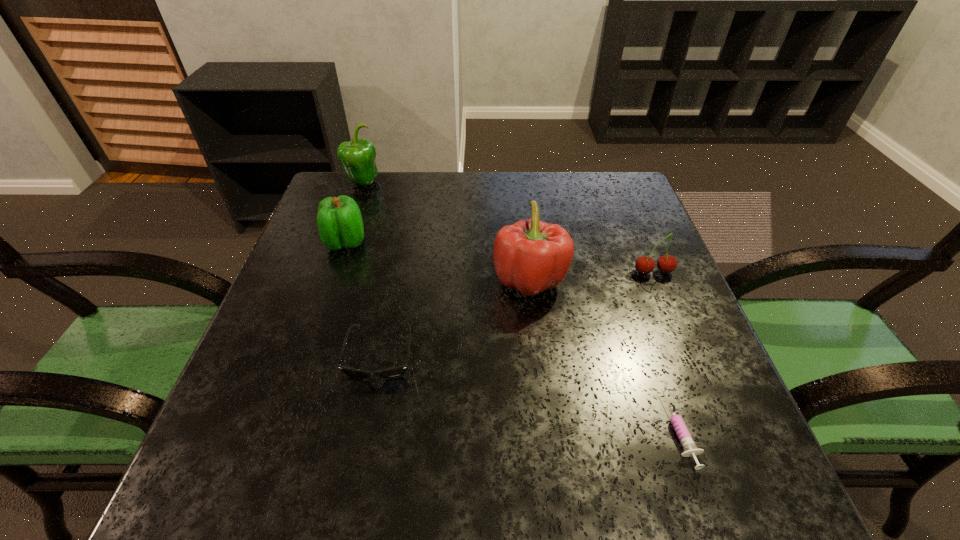
This screenshot has width=960, height=540. Identify the location of vacant space that's between the fifth tallest object and the shortest object. (531, 393).

This screenshot has width=960, height=540. What are the coordinates of `vacant area that lies between the cherry and the shortest object` in the screenshot? It's located at (667, 350).

You are a GUI agent. You are given a task and a screenshot of the screen. Output one action in this format:
    pyautogui.click(x=<x>, y=<y>)
    Task: Click on the third closest object relative to the cherry
    The width and height of the screenshot is (960, 540).
    Given the screenshot: What is the action you would take?
    pyautogui.click(x=391, y=373)

Locate which object is the fifth closest to the sunglasses. Please provide its 2D coordinates. Your answer should be formatted as a tuple, i.e. [(x, y)], where the tuple contains the x and y coordinates of a point satisfying the conditions above.

[(667, 263)]

Locate an element on the screen. This screenshot has width=960, height=540. bell pepper that is the second closest to the second shortest object is located at coordinates (339, 220).

Locate which bell pepper is the second closest to the shortest bell pepper. Please provide its 2D coordinates. Your answer should be formatted as a tuple, i.e. [(x, y)], where the tuple contains the x and y coordinates of a point satisfying the conditions above.

[(532, 256)]

Where is `free space that satisfies the following two spatial constraints: 1. on the front side of the farthest bell pepper; 2. on the right side of the syringe`? free space that satisfies the following two spatial constraints: 1. on the front side of the farthest bell pepper; 2. on the right side of the syringe is located at coordinates (275, 429).

This screenshot has height=540, width=960. I want to click on free space that satisfies the following two spatial constraints: 1. on the front side of the farthest object; 2. on the right side of the shortest object, so click(x=275, y=429).

Where is `vacant space that satisfies the following two spatial constraints: 1. on the front side of the shortest bell pepper; 2. on the right side of the farthest bell pepper`? vacant space that satisfies the following two spatial constraints: 1. on the front side of the shortest bell pepper; 2. on the right side of the farthest bell pepper is located at coordinates (341, 242).

Where is `free spot that satisfies the following two spatial constraints: 1. on the front-facing side of the shortest object; 2. on the left side of the fifth farthest object`? Image resolution: width=960 pixels, height=540 pixels. free spot that satisfies the following two spatial constraints: 1. on the front-facing side of the shortest object; 2. on the left side of the fifth farthest object is located at coordinates (366, 429).